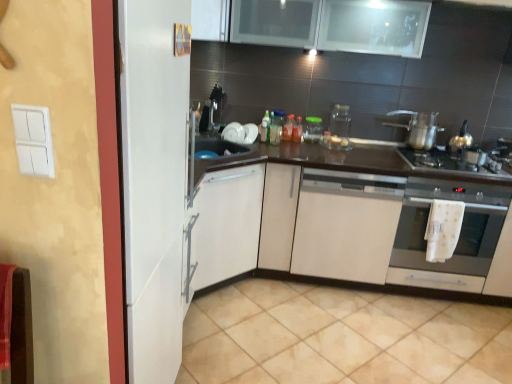
Where is `white plastic light switch at left`? This screenshot has width=512, height=384. white plastic light switch at left is located at coordinates (33, 140).

This screenshot has width=512, height=384. What do you see at coordinates (33, 140) in the screenshot?
I see `white plastic light switch at left` at bounding box center [33, 140].

Describe the element at coordinates (341, 337) in the screenshot. The image size is (512, 384). I see `beige tile at lower center` at that location.

This screenshot has width=512, height=384. I want to click on metallic silver gas stove at right, so click(453, 162).

Image resolution: width=512 pixels, height=384 pixels. What do you see at coordinates (265, 127) in the screenshot?
I see `translucent glass bottle at center, which appears as the 4th bottle when viewed from the right` at bounding box center [265, 127].

Image resolution: width=512 pixels, height=384 pixels. What do you see at coordinates (364, 220) in the screenshot? I see `dark wood countertop at center` at bounding box center [364, 220].

Describe the element at coordinates (460, 139) in the screenshot. I see `gold metallic tea pot at right` at that location.

Image resolution: width=512 pixels, height=384 pixels. Describe the element at coordinates (288, 128) in the screenshot. I see `translucent plastic bottle at center, arranged as the 2th bottle when viewed from the right` at that location.

Locate an element on the screen. white plastic light switch at left is located at coordinates pos(33,140).

Is transparent glass jar at center, which is the third appliance from left to right, not within translucent glass jar at center, which is counted as the third bottle, starting from the right?

Yes.

Is transparent glass jar at center, which is the third appliance from left to right, turned away from translucent glass jar at center, which is counted as the third bottle, starting from the right?

No, transparent glass jar at center, which is the third appliance from left to right,'s orientation is not away from translucent glass jar at center, which is counted as the third bottle, starting from the right.

From a real-world perspective, is transparent glass jar at center, which is the third appliance from left to right, physically above translucent glass jar at center, the 2th bottle when ordered from left to right?

Yes, from a real-world perspective, transparent glass jar at center, which is the third appliance from left to right, is on top of translucent glass jar at center, the 2th bottle when ordered from left to right.

Could you measure the distance between translucent glass bottle at center, which appears as the 1th bottle when viewed from the left, and gold metallic tea pot at right?

A distance of 3.95 feet exists between translucent glass bottle at center, which appears as the 1th bottle when viewed from the left, and gold metallic tea pot at right.

Is translucent glass bottle at center, which appears as the 4th bottle when viewed from the right, wider or thinner than gold metallic tea pot at right?

translucent glass bottle at center, which appears as the 4th bottle when viewed from the right, is thinner than gold metallic tea pot at right.

Would you say translucent glass bottle at center, which appears as the 1th bottle when viewed from the left, is inside or outside gold metallic tea pot at right?

translucent glass bottle at center, which appears as the 1th bottle when viewed from the left, lies outside gold metallic tea pot at right.

Can you confirm if translucent glass bottle at center, which appears as the 1th bottle when viewed from the left, is smaller than gold metallic tea pot at right?

Indeed, translucent glass bottle at center, which appears as the 1th bottle when viewed from the left, has a smaller size compared to gold metallic tea pot at right.

In the scene shown: Between translucent plastic bottle at center, placed as the 3th bottle when sorted from left to right, and translucent glass jar at center, which is counted as the third bottle, starting from the right, which one has less height?

translucent plastic bottle at center, placed as the 3th bottle when sorted from left to right.

Can we say translucent plastic bottle at center, arranged as the 2th bottle when viewed from the right, lies outside translucent glass jar at center, which is counted as the third bottle, starting from the right?

Yes, translucent plastic bottle at center, arranged as the 2th bottle when viewed from the right, is not within translucent glass jar at center, which is counted as the third bottle, starting from the right.

From a real-world perspective, is translucent plastic bottle at center, placed as the 3th bottle when sorted from left to right, physically located above or below translucent glass jar at center, the 2th bottle when ordered from left to right?

translucent plastic bottle at center, placed as the 3th bottle when sorted from left to right, is situated higher than translucent glass jar at center, the 2th bottle when ordered from left to right, in the real world.

Find the location of `bottle above the translucent plastic bottle at center, arranged as the 2th bottle when viewed from the right (from the image's perspective)`. bottle above the translucent plastic bottle at center, arranged as the 2th bottle when viewed from the right (from the image's perspective) is located at coordinates (276, 127).

From a real-world perspective, between white matte cabinet at center and translucent glass jar at center, the 2th bottle when ordered from left to right, who is vertically lower?

white matte cabinet at center.

Which is nearer, (x=396, y=229) or (x=282, y=124)?

The point (x=396, y=229) is closer to the camera.

Does point (416, 194) come closer to viewer compared to point (32, 141)?

No, it is behind (32, 141).

From a real-world perspective, who is located higher, satin silver oven at lower right or white plastic light switch at left?

white plastic light switch at left, from a real-world perspective.

From the image's perspective, which is below, satin silver oven at lower right or white plastic light switch at left?

satin silver oven at lower right.

In terms of size, does white glossy plate at upper center, the 1th appliance in the left-to-right sequence, appear bigger or smaller than metallic silver gas stove at right?

Clearly, white glossy plate at upper center, the 1th appliance in the left-to-right sequence, is smaller in size than metallic silver gas stove at right.

From the picture: Is white glossy plate at upper center, which is counted as the 3th appliance, starting from the right, not within metallic silver gas stove at right?

Yes.

How different are the orientations of white glossy plate at upper center, the 1th appliance in the left-to-right sequence, and metallic silver gas stove at right in degrees?

35.9 degrees separate the facing orientations of white glossy plate at upper center, the 1th appliance in the left-to-right sequence, and metallic silver gas stove at right.

From a real-world perspective, is white glossy plate at upper center, the 1th appliance in the left-to-right sequence, on metallic silver gas stove at right?

Indeed, from a real-world perspective, white glossy plate at upper center, the 1th appliance in the left-to-right sequence, stands above metallic silver gas stove at right.

From a real-world perspective, is beige tile at lower center over gold metallic tea pot at right?

No, from a real-world perspective, beige tile at lower center is not on top of gold metallic tea pot at right.

Is beige tile at lower center completely or partially outside of gold metallic tea pot at right?

beige tile at lower center is positioned outside gold metallic tea pot at right.

In the image, is beige tile at lower center on the left side or the right side of gold metallic tea pot at right?

beige tile at lower center is to the left of gold metallic tea pot at right.

From the translucent glass jar at center, which is counted as the third bottle, starting from the right, count 2nd appliance to the right and point to it. Please provide its 2D coordinates.

[(339, 127)]

I want to click on the 1st bottle behind the gold metallic tea pot at right, so click(265, 127).

From the image, which object appears to be nearer to shiny metallic pot at center right, translucent plastic bottle at center, the 1th bottle viewed from the right, or translucent glass bottle at center, which appears as the 4th bottle when viewed from the right?

translucent plastic bottle at center, the 1th bottle viewed from the right, lies closer to shiny metallic pot at center right than the other object.

Which object lies further to the anchor point transparent glass jar at center, which is the second appliance from right to left, metallic silver gas stove at right or transparent glass jar at center, acting as the first appliance starting from the right?

metallic silver gas stove at right.

From the image, which object appears to be nearer to white glossy plate at upper center, the 1th appliance in the left-to-right sequence, translucent plastic bottle at center, the 1th bottle viewed from the right, or shiny metallic pot at center right?

translucent plastic bottle at center, the 1th bottle viewed from the right, lies closer to white glossy plate at upper center, the 1th appliance in the left-to-right sequence, than the other object.

Looking at the image, which one is located further to translucent glass jar at center, the 2th bottle when ordered from left to right, white glossy plate at upper center, which is counted as the 3th appliance, starting from the right, or translucent glass bottle at center, which appears as the 4th bottle when viewed from the right?

The object further to translucent glass jar at center, the 2th bottle when ordered from left to right, is white glossy plate at upper center, which is counted as the 3th appliance, starting from the right.

When comparing their distances from beige tile at lower center, does transparent glass jar at center, acting as the first appliance starting from the right, or translucent plastic bottle at center, the 1th bottle viewed from the right, seem further?

Among the two, translucent plastic bottle at center, the 1th bottle viewed from the right, is located further to beige tile at lower center.

Considering their positions, is shiny metallic pot at center right positioned closer to translucent glass bottle at center, which appears as the 1th bottle when viewed from the left, than translucent plastic bottle at center, placed as the 3th bottle when sorted from left to right?

The object closer to translucent glass bottle at center, which appears as the 1th bottle when viewed from the left, is translucent plastic bottle at center, placed as the 3th bottle when sorted from left to right.

Considering their positions, is translucent glass bottle at center, which appears as the 4th bottle when viewed from the right, positioned closer to white matte cabinet at center than beige tile at lower center?

The object closer to white matte cabinet at center is beige tile at lower center.

Which object lies nearer to the anchor point white plastic light switch at left, translucent plastic bottle at center, the fourth bottle positioned from the left, or translucent glass bottle at center, which appears as the 1th bottle when viewed from the left?

translucent glass bottle at center, which appears as the 1th bottle when viewed from the left.

At what (x,y) coordinates should I click in order to perform the action: click on oven between metallic silver gas stove at right and beige tile at lower center vertically. Please return your answer as a coordinate pair (x, y). The height and width of the screenshot is (384, 512). Looking at the image, I should click on (458, 240).

The width and height of the screenshot is (512, 384). I want to click on countertop between translucent plastic bottle at center, the 1th bottle viewed from the right, and beige tile at lower center, in the vertical direction, so click(364, 220).

Locate an element on the screen. The height and width of the screenshot is (384, 512). countertop between white glossy plate at upper center, the 1th appliance in the left-to-right sequence, and metallic silver gas stove at right is located at coordinates (364, 220).

The width and height of the screenshot is (512, 384). I want to click on cabinetry between transparent glass jar at center, placed as the 2th appliance when sorted from left to right, and satin silver oven at lower right, in the horizontal direction, so click(346, 225).